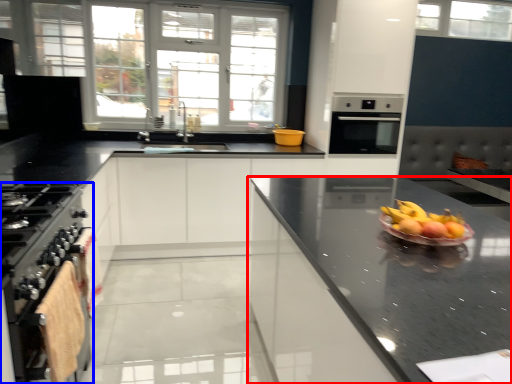
Question: Among these objects, which one is farthest to the camera, cabinetry (highlighted by a red box) or kitchen appliance (highlighted by a blue box)?

Choices:
 (A) cabinetry
 (B) kitchen appliance

Answer: (B)